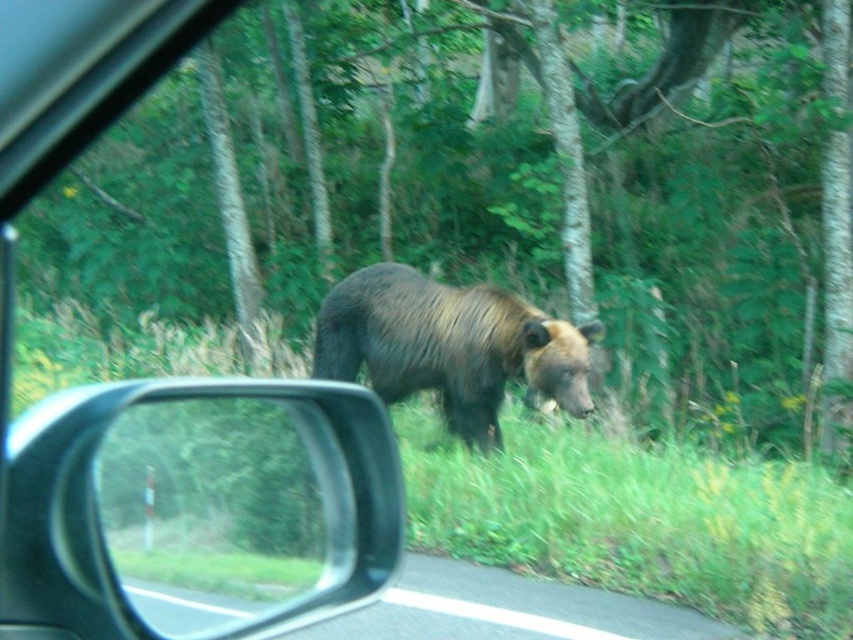
Question: Is green leafy tree at center thinner than clear plastic side mirror at lower left?

Choices:
 (A) no
 (B) yes

Answer: (A)

Question: Does clear plastic side mirror at lower left appear over brown furry bear at center?

Choices:
 (A) no
 (B) yes

Answer: (A)

Question: Among these points, which one is nearest to the camera?

Choices:
 (A) (190, 124)
 (B) (581, 358)
 (C) (288, 392)

Answer: (C)

Question: Is green leafy tree at center positioned at the back of brown furry bear at center?

Choices:
 (A) no
 (B) yes

Answer: (A)

Question: Which point appears farthest from the camera in this image?

Choices:
 (A) (142, 500)
 (B) (843, 440)
 (C) (380, 296)

Answer: (B)

Question: Among these points, which one is farthest from the camera?

Choices:
 (A) pyautogui.click(x=293, y=449)
 (B) pyautogui.click(x=833, y=296)
 (C) pyautogui.click(x=376, y=371)

Answer: (B)